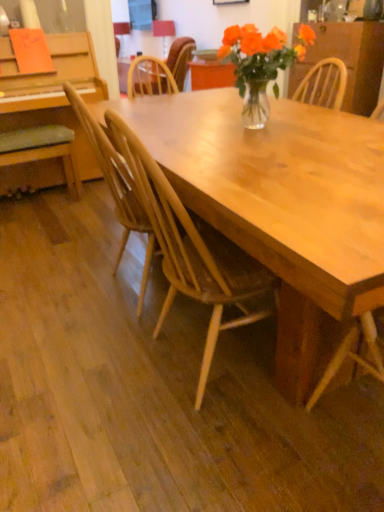
Question: Considering their positions, is green fabric cushion at left, which appears as the 3th chair when viewed from the front, located in front of or behind light brown wood chair at center, marked as the 2th chair in a front-to-back arrangement?

Choices:
 (A) front
 (B) behind

Answer: (B)

Question: Looking at their shapes, would you say green fabric cushion at left, positioned as the second chair in back-to-front order, is wider or thinner than light brown wood chair at center, marked as the 2th chair in a front-to-back arrangement?

Choices:
 (A) thin
 (B) wide

Answer: (A)

Question: Estimate the real-world distances between objects in this image. Which object is farther from the translucent glass vase at center?

Choices:
 (A) light brown wood chair at center, which is the 3th chair from back to front
 (B) wooden chair at center, which ranks as the 1th chair in back-to-front order
 (C) wooden dresser at upper right
 (D) green fabric cushion at left, which is the 3th chair in bottom-to-top order
 (E) wooden chair at center, positioned as the fourth chair in back-to-front order

Answer: (C)

Question: Estimate the real-world distances between objects in this image. Which object is farther from the wooden chair at center, which is the 1th chair from front to back?

Choices:
 (A) green fabric cushion at left, which is the 3th chair in bottom-to-top order
 (B) translucent glass vase at center
 (C) wooden chair at center, which is the fourth chair in bottom-to-top order
 (D) light brown wood chair at center, the 3th chair positioned from the top
 (E) wooden dresser at upper right

Answer: (E)